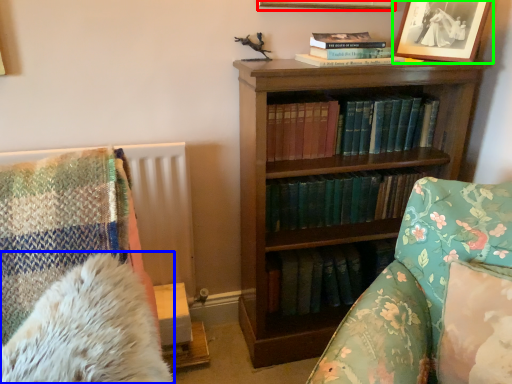
Question: Which object is positioned closest to picture frame (highlighted by a red box)? Select from chiffonier (highlighted by a blue box) and picture frame (highlighted by a green box).

Choices:
 (A) chiffonier
 (B) picture frame

Answer: (B)